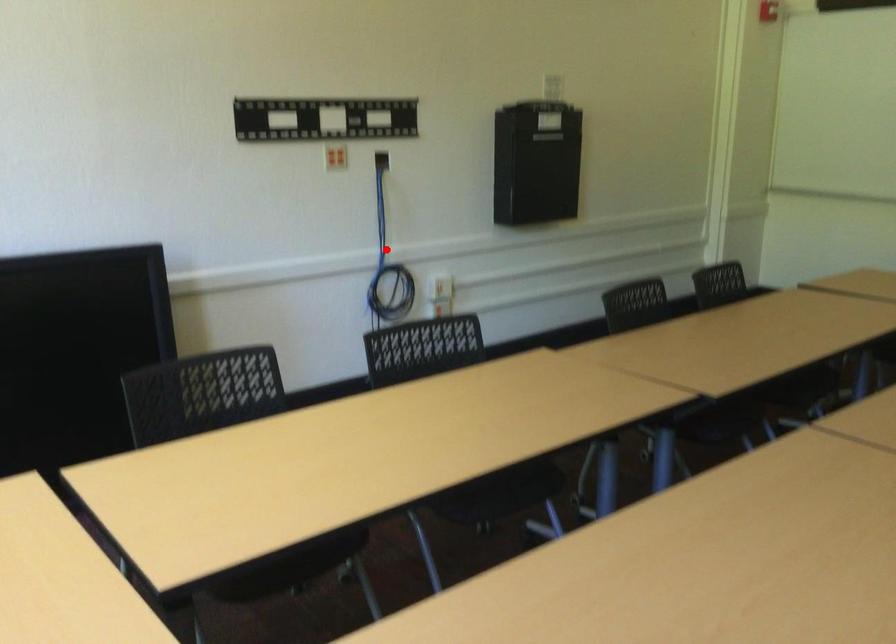
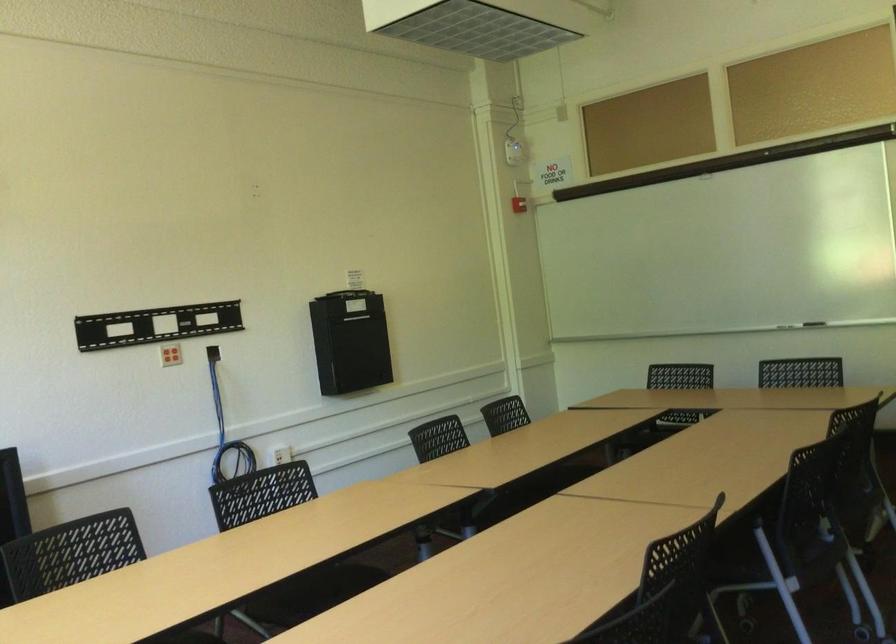
Question: I am providing you with two images of the same scene from different viewpoints. A red point is marked on the first image. At the location where the point appears in image 1, is it still visible in image 2?

Choices:
 (A) Yes
 (B) No

Answer: (A)